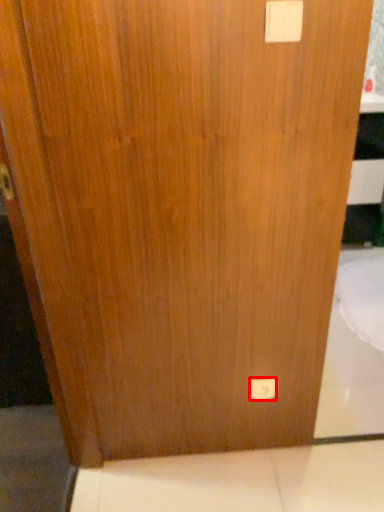
Question: From the image's perspective, where is light switch (annotated by the red box) located relative to light switch?

Choices:
 (A) below
 (B) above

Answer: (A)